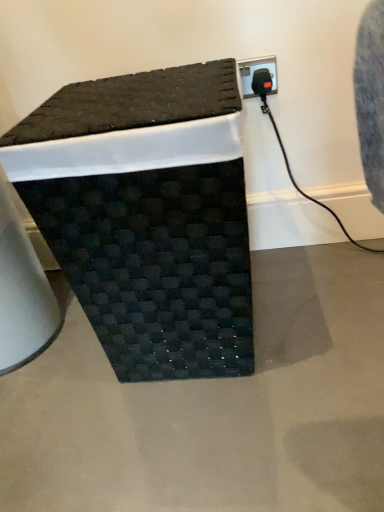
Locate an element on the screen. vacant space situated above black woven basket at center (from a real-world perspective) is located at coordinates (118, 86).